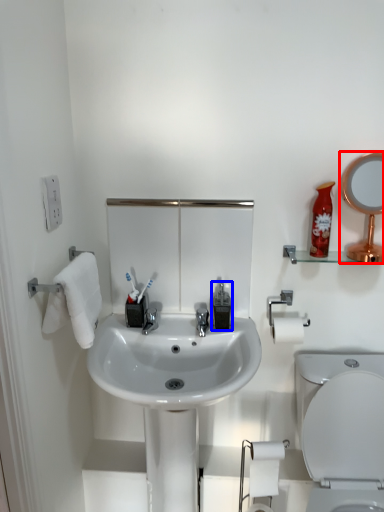
Question: Which object appears closest to the camera in this image, mirror (highlighted by a red box) or soap dispenser (highlighted by a blue box)?

Choices:
 (A) mirror
 (B) soap dispenser

Answer: (A)